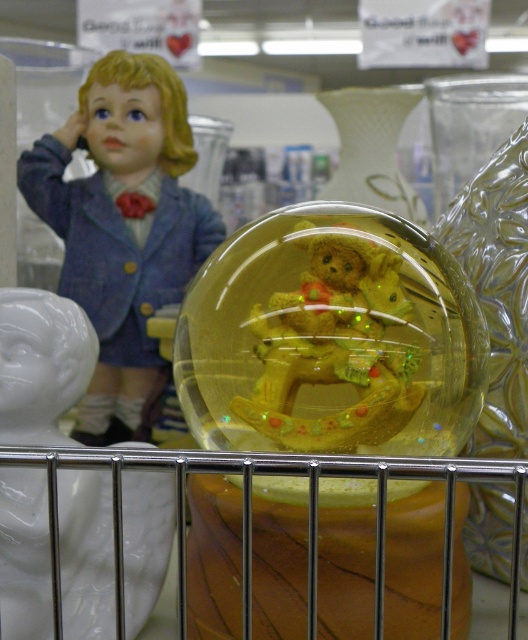
Question: Among these points, which one is nearest to the camera?

Choices:
 (A) (138, 196)
 (B) (301, 280)

Answer: (B)

Question: Which point is closer to the camera?

Choices:
 (A) matte blue fabric doll at upper left
 (B) translucent yellow bear at center

Answer: (B)

Question: Considering the relative positions of matte blue fabric doll at upper left and translucent yellow bear at center in the image provided, where is matte blue fabric doll at upper left located with respect to translucent yellow bear at center?

Choices:
 (A) above
 (B) below

Answer: (A)

Question: Which of the following is the closest to the observer?

Choices:
 (A) matte blue fabric doll at upper left
 (B) translucent yellow bear at center

Answer: (B)

Question: Does matte blue fabric doll at upper left lie in front of translucent yellow bear at center?

Choices:
 (A) no
 (B) yes

Answer: (A)

Question: Does matte blue fabric doll at upper left have a larger size compared to translucent yellow bear at center?

Choices:
 (A) yes
 (B) no

Answer: (A)